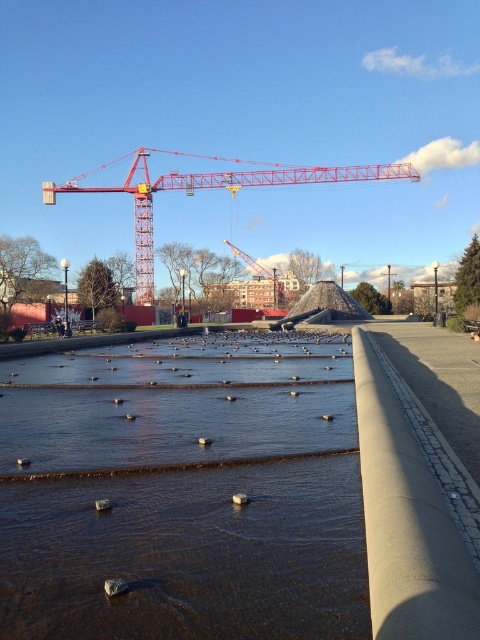
You are standing at the origin point of the image. You want to walk to the clear water at center. Which direction should you go?

The clear water at center is located at point (182,499), so you should move towards the right and slightly upwards from your current position at the origin.

From the picture: You are a construction worker standing at the base of the metallic red crane at center. You need to place a heavy object on the clear water at center. Can you safely do this? Please explain your reasoning based on the distance between them.

The clear water at center is 71.83 meters away from the metallic red crane at center. Since the crane is positioned at the center and the water is over 70 meters away, placing a heavy object directly on the water might not be feasible due to the distance and potential structural limitations of the crane. The crane may not have the reach required to safely lower the object that far.